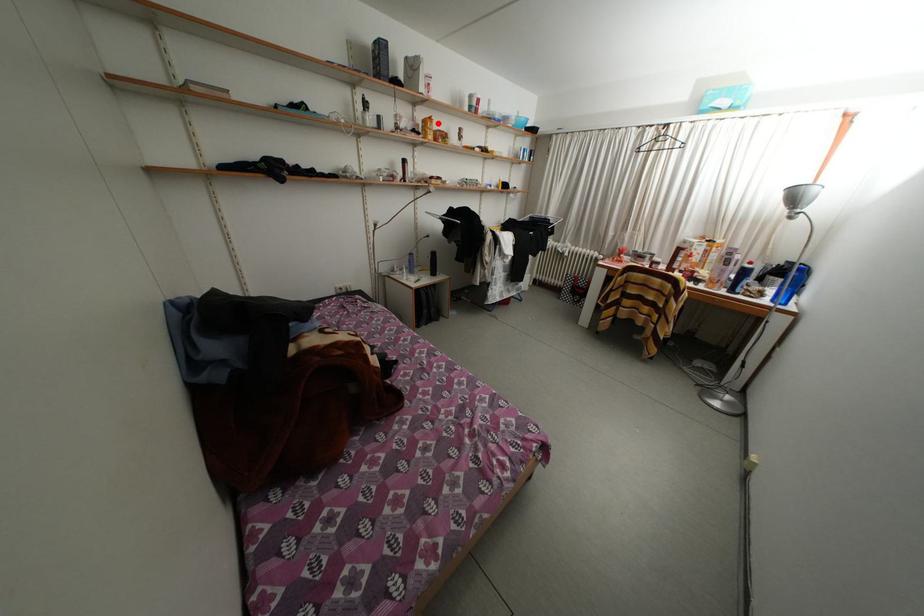
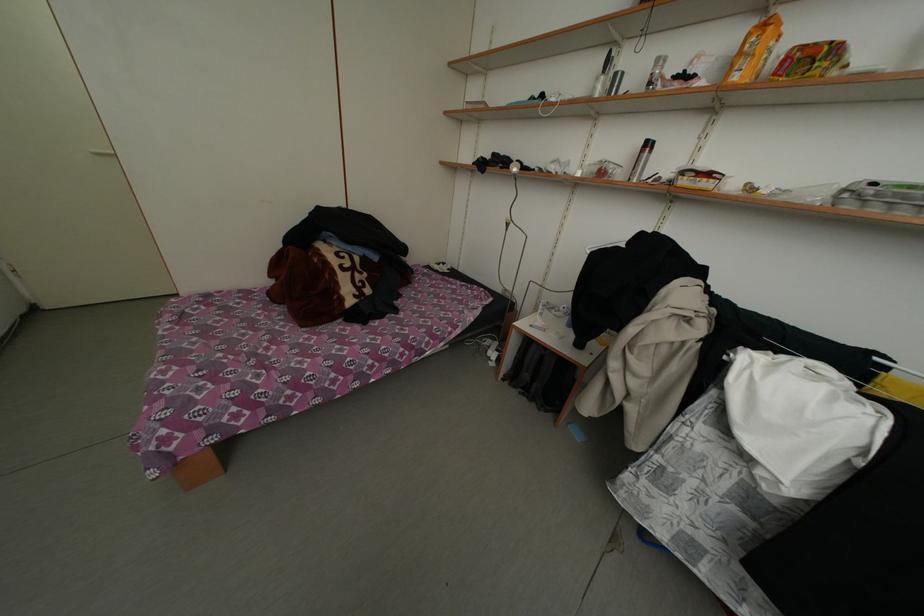
Question: I am providing you with two images of the same scene from different viewpoints. A red point is shown in image1. For the corresponding object point in image2, is it positioned nearer or farther from the camera?

Choices:
 (A) Nearer
 (B) Farther

Answer: (B)